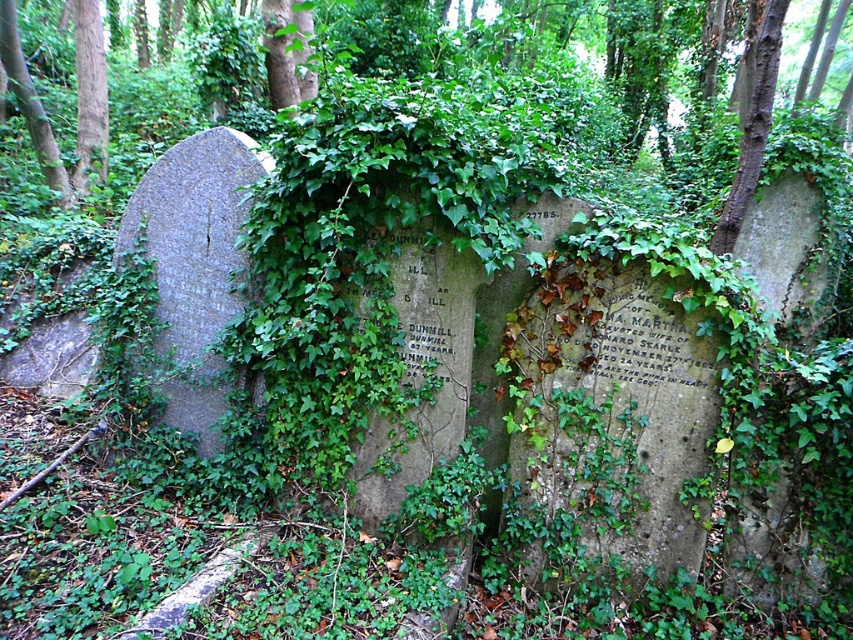
Question: Does brown wood tree at upper left appear over green leafy tree at left?

Choices:
 (A) yes
 (B) no

Answer: (A)

Question: Is brown wood tree at upper left bigger than green leafy tree at left?

Choices:
 (A) no
 (B) yes

Answer: (B)

Question: Among these objects, which one is nearest to the camera?

Choices:
 (A) brown wood tree at upper left
 (B) green leafy tree at left

Answer: (B)

Question: Can you confirm if brown wood tree at upper left is positioned to the left of green leafy tree at left?

Choices:
 (A) no
 (B) yes

Answer: (A)